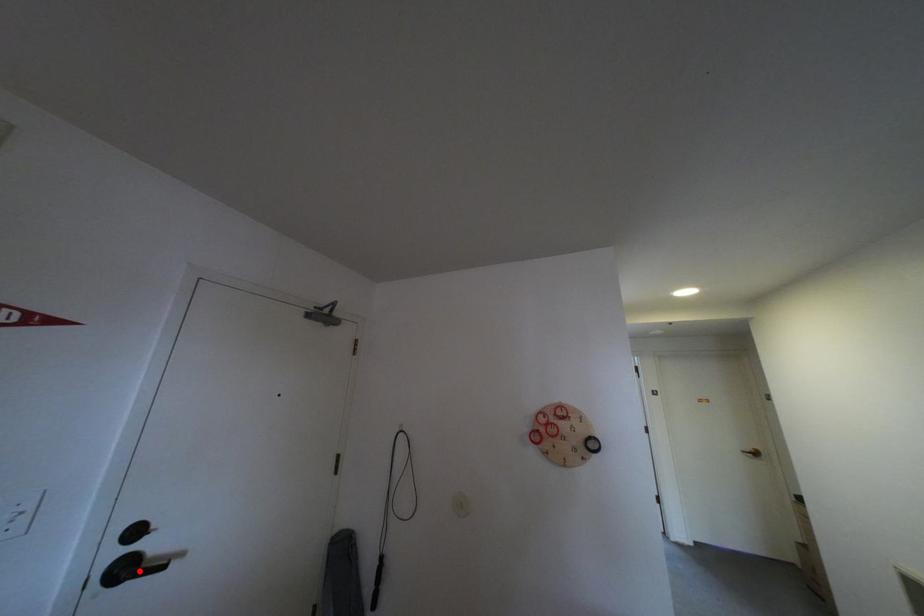
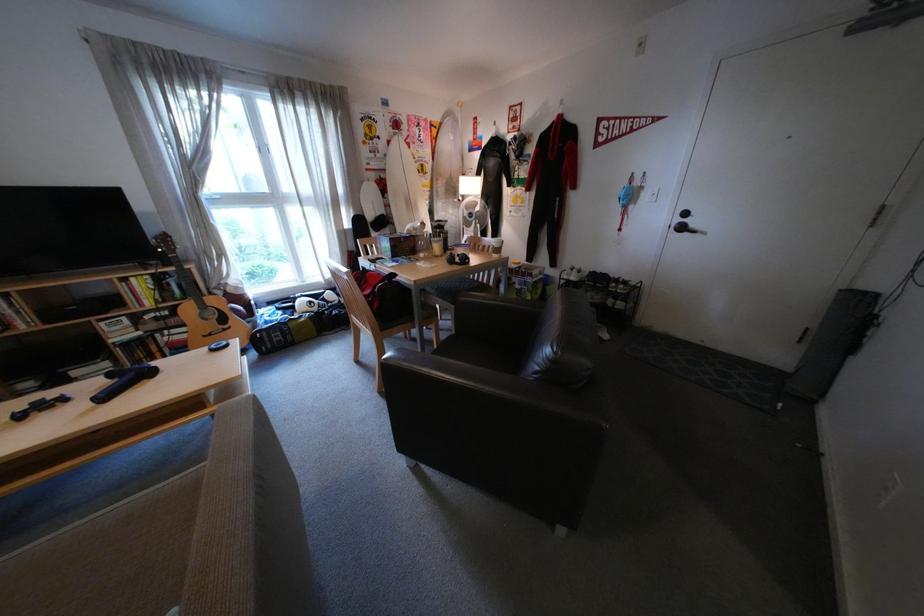
The point at the highlighted location is marked in the first image. Where is the corresponding point in the second image?

(696, 229)